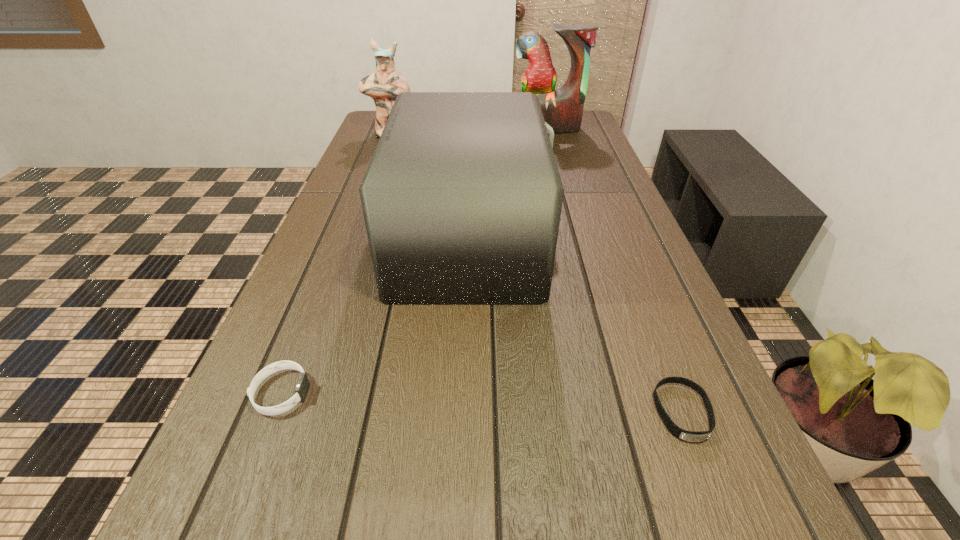
Find the location of a particular element. Image resolution: width=960 pixels, height=540 pixels. free space at the right edge of the desktop is located at coordinates (621, 279).

You are a GUI agent. You are given a task and a screenshot of the screen. Output one action in this format:
    pyautogui.click(x=<x>, y=<y>)
    Task: Click on the empty location between the third farthest object and the taller wristband
    The image size is (960, 540).
    Given the screenshot: What is the action you would take?
    pyautogui.click(x=376, y=315)

Where is `unoccupied position between the shortest object and the microwave oven`? This screenshot has width=960, height=540. unoccupied position between the shortest object and the microwave oven is located at coordinates point(577,325).

I want to click on blank region between the shortest object and the microwave oven, so click(x=577, y=325).

Identify the location of vacant area that lies between the figurine and the second shortest object. (336, 264).

Identify the location of vacant point located between the taller wristband and the right wristband. (482, 402).

Identify the location of the second closest object to the parrot. (462, 199).

The height and width of the screenshot is (540, 960). Identify the location of object that is the third closest one to the third farthest object. (386, 83).

Where is `vacant region that satisfies the following two spatial constraints: 1. at the face of the parrot; 2. on the outer surface of the left wristband`? vacant region that satisfies the following two spatial constraints: 1. at the face of the parrot; 2. on the outer surface of the left wristband is located at coordinates (623, 393).

I want to click on vacant area in the image that satisfies the following two spatial constraints: 1. at the face of the parrot; 2. on the outer surface of the second shortest object, so (x=623, y=393).